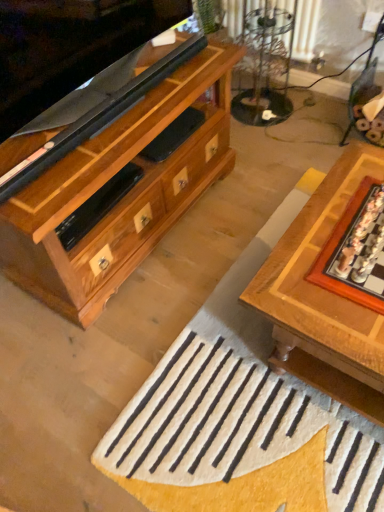
Question: Is wooden chessboard at center smaller than white woolen doormat at center?

Choices:
 (A) yes
 (B) no

Answer: (B)

Question: Is wooden chessboard at center at the left side of white woolen doormat at center?

Choices:
 (A) no
 (B) yes

Answer: (A)

Question: From the image's perspective, is wooden chessboard at center under white woolen doormat at center?

Choices:
 (A) no
 (B) yes

Answer: (A)

Question: Can you confirm if wooden chessboard at center is positioned to the right of white woolen doormat at center?

Choices:
 (A) no
 (B) yes

Answer: (B)

Question: Is wooden chessboard at center facing towards white woolen doormat at center?

Choices:
 (A) no
 (B) yes

Answer: (A)

Question: Can you confirm if wooden chessboard at center is thinner than white woolen doormat at center?

Choices:
 (A) yes
 (B) no

Answer: (A)

Question: Is wooden board game at right at the left side of clear glass table at upper center?

Choices:
 (A) no
 (B) yes

Answer: (A)

Question: Considering the relative sizes of wooden board game at right and clear glass table at upper center in the image provided, is wooden board game at right wider than clear glass table at upper center?

Choices:
 (A) yes
 (B) no

Answer: (A)

Question: Is wooden board game at right bigger than clear glass table at upper center?

Choices:
 (A) yes
 (B) no

Answer: (B)

Question: Is wooden board game at right not close to clear glass table at upper center?

Choices:
 (A) yes
 (B) no

Answer: (A)

Question: Can you confirm if wooden board game at right is shorter than clear glass table at upper center?

Choices:
 (A) yes
 (B) no

Answer: (A)

Question: Considering the relative sizes of wooden board game at right and clear glass table at upper center in the image provided, is wooden board game at right thinner than clear glass table at upper center?

Choices:
 (A) no
 (B) yes

Answer: (A)

Question: Does clear glass table at upper center appear on the right side of white woolen doormat at center?

Choices:
 (A) yes
 (B) no

Answer: (B)